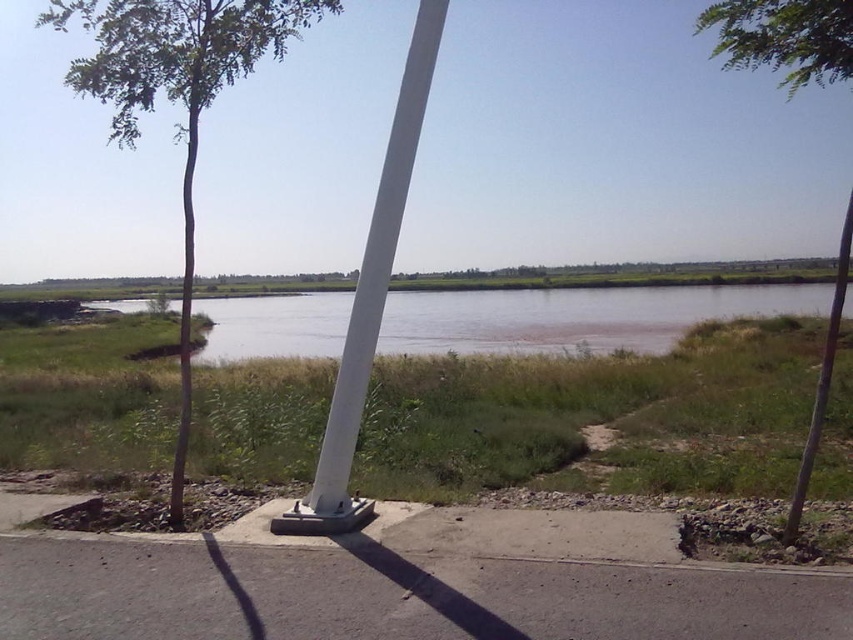
Question: Which of the following is the farthest from the observer?

Choices:
 (A) (751, 3)
 (B) (206, 634)

Answer: (A)

Question: Where is brown sedimentary river at center located in relation to green leafy tree at upper left in the image?

Choices:
 (A) right
 (B) left

Answer: (B)

Question: Is gray asphalt pavement at lower center smaller than green leafy tree at left?

Choices:
 (A) yes
 (B) no

Answer: (A)

Question: Which point is closer to the camera taking this photo?

Choices:
 (A) (848, 237)
 (B) (666, 307)
 (C) (318, 508)

Answer: (C)

Question: Which is farther from the gray asphalt pavement at lower center?

Choices:
 (A) white smooth pole at center
 (B) brown sedimentary river at center

Answer: (B)

Question: Is gray asphalt pavement at lower center positioned at the back of green leafy tree at left?

Choices:
 (A) no
 (B) yes

Answer: (A)